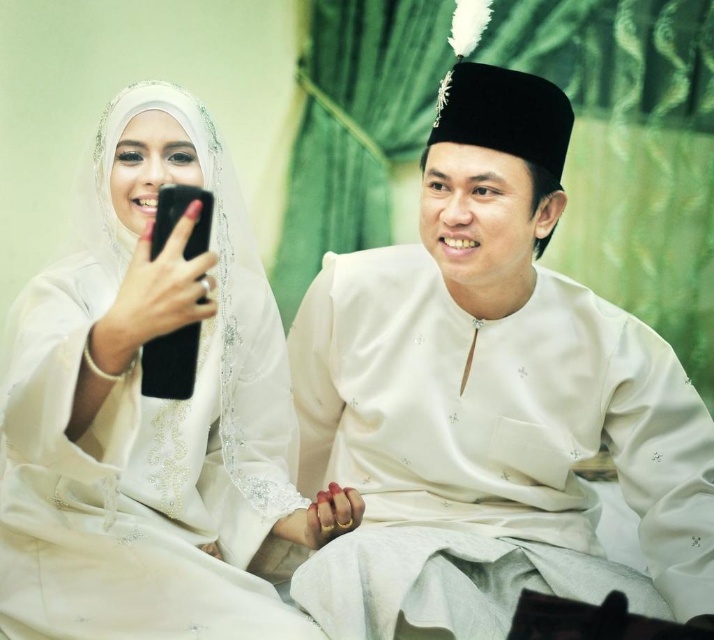
Is white satin khat at center bigger than white sheer dress at left?

Correct, white satin khat at center is larger in size than white sheer dress at left.

Can you confirm if white satin khat at center is positioned to the left of white sheer dress at left?

Incorrect, white satin khat at center is not on the left side of white sheer dress at left.

What do you see at coordinates (488, 400) in the screenshot? This screenshot has width=714, height=640. I see `white satin khat at center` at bounding box center [488, 400].

Locate an element on the screen. white satin khat at center is located at coordinates (488, 400).